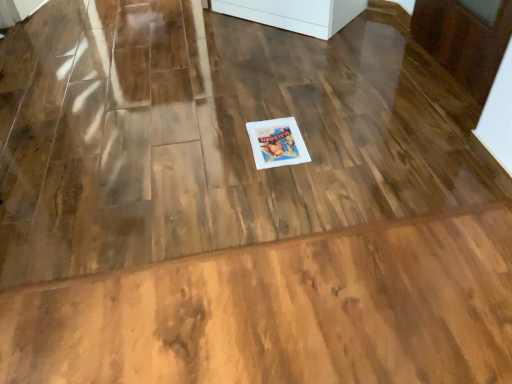
Find the location of a particular element. This screenshot has height=384, width=512. vacant location below white glossy comic book at center (from a real-world perspective) is located at coordinates (274, 140).